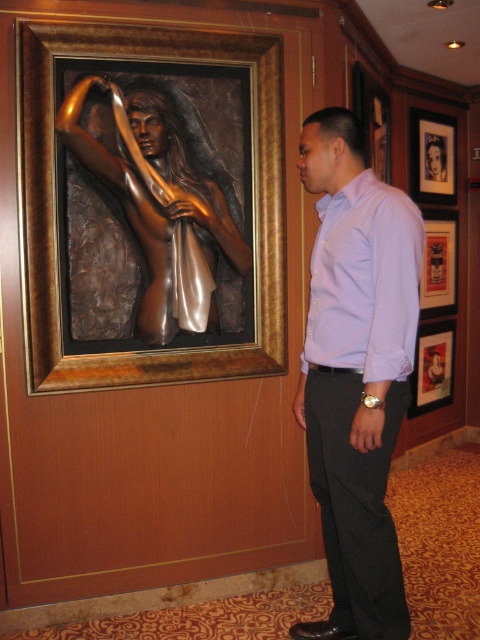
You are an art curator examining the layout of the room. The man is standing at the center of the room. You need to place a new sculpture exactly at point (56, 202). Where should you place it relative to the existing bronze metallic sculpture at left?

The point (56, 202) corresponds to the bronze metallic sculpture at left, so you should place the new sculpture at the same location as the bronze metallic sculpture at left.

You are an artist analyzing the composition of the scene. You notice a specific point marked at coordinates (356, 372). Based on the scene description, can you determine which object this point is located on?

The point at coordinates (356, 372) is located on the purple cotton shirt at center.

You are an interior designer planning to install a new light fixture between the bronzemetallicsculpture at left and the matte black picture frame at upper right. The fixture requires a minimum of 5 feet of space between the two objects to be safely installed. Can the fixture be placed there?

The distance between the bronzemetallicsculpture at left and the matte black picture frame at upper right is 6.36 feet, which exceeds the required 5 feet. Therefore, the light fixture can be safely installed between them.